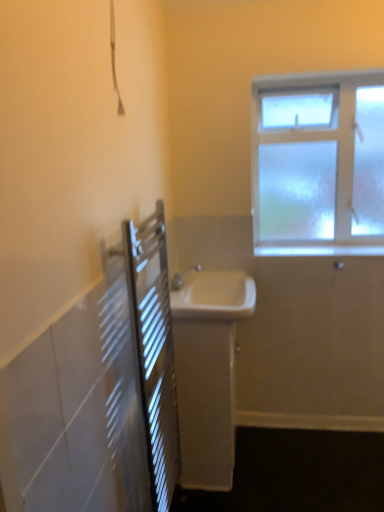
Question: Is white glossy sink at center, acting as the 1th sink starting from the top, not inside white glossy window sill at upper right?

Choices:
 (A) no
 (B) yes

Answer: (B)

Question: Considering the relative positions of white glossy sink at center, acting as the 1th sink starting from the top, and white glossy window sill at upper right in the image provided, is white glossy sink at center, acting as the 1th sink starting from the top, to the right of white glossy window sill at upper right from the viewer's perspective?

Choices:
 (A) yes
 (B) no

Answer: (B)

Question: From a real-world perspective, does white glossy sink at center, acting as the second sink starting from the bottom, stand above white glossy window sill at upper right?

Choices:
 (A) no
 (B) yes

Answer: (A)

Question: Does white glossy sink at center, acting as the 1th sink starting from the top, have a larger size compared to white glossy window sill at upper right?

Choices:
 (A) yes
 (B) no

Answer: (A)

Question: Can you confirm if white glossy sink at center, acting as the 1th sink starting from the top, is thinner than white glossy window sill at upper right?

Choices:
 (A) no
 (B) yes

Answer: (A)

Question: From the image's perspective, is white glossy sink at center, acting as the 1th sink starting from the top, located beneath white glossy window sill at upper right?

Choices:
 (A) yes
 (B) no

Answer: (A)

Question: Is white glossy sink at center, the first sink ordered from the bottom, outside white glossy sink at center, acting as the 1th sink starting from the top?

Choices:
 (A) yes
 (B) no

Answer: (A)

Question: From the image's perspective, is white glossy sink at center, the first sink ordered from the bottom, located beneath white glossy sink at center, acting as the 1th sink starting from the top?

Choices:
 (A) yes
 (B) no

Answer: (A)

Question: Does white glossy sink at center, which is the second sink in top-to-bottom order, have a greater width compared to white glossy sink at center, acting as the second sink starting from the bottom?

Choices:
 (A) yes
 (B) no

Answer: (B)

Question: Is white glossy sink at center, the first sink ordered from the bottom, to the right of white glossy sink at center, acting as the 1th sink starting from the top, from the viewer's perspective?

Choices:
 (A) no
 (B) yes

Answer: (A)

Question: From a real-world perspective, is white glossy sink at center, the first sink ordered from the bottom, physically below white glossy sink at center, acting as the 1th sink starting from the top?

Choices:
 (A) yes
 (B) no

Answer: (A)

Question: Is white glossy sink at center, which is the second sink in top-to-bottom order, closer to the viewer compared to white glossy sink at center, acting as the 1th sink starting from the top?

Choices:
 (A) yes
 (B) no

Answer: (B)

Question: Considering the relative positions of white glossy sink at center, the first sink ordered from the bottom, and white glossy window sill at upper right in the image provided, is white glossy sink at center, the first sink ordered from the bottom, behind white glossy window sill at upper right?

Choices:
 (A) no
 (B) yes

Answer: (A)